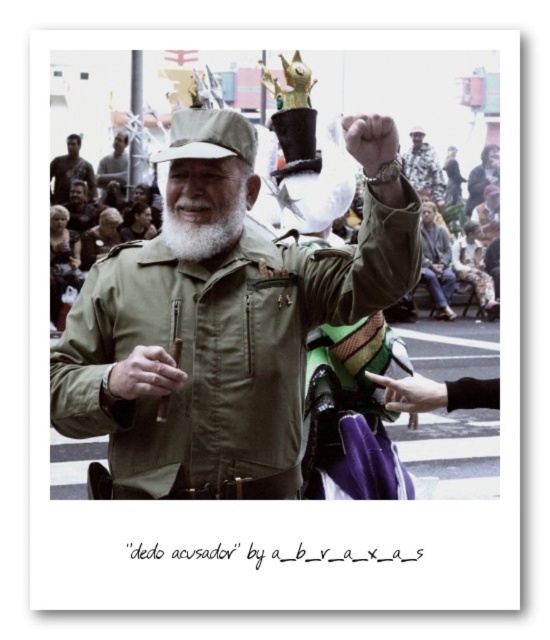
Question: Can you confirm if matte green jacket at center is positioned below matte brown shirt at upper left?

Choices:
 (A) yes
 (B) no

Answer: (A)

Question: Which of the following is the farthest from the observer?

Choices:
 (A) matte black cap at upper center
 (B) matte brown shirt at upper left
 (C) camouflage fabric watch at upper right
 (D) green matte jacket at center

Answer: (C)

Question: Is white matte beard at center closer to camera compared to matte brown hand at upper center?

Choices:
 (A) yes
 (B) no

Answer: (B)

Question: Which of the following is the farthest from the observer?

Choices:
 (A) camouflage fabric watch at upper right
 (B) matte khaki hat at center
 (C) matte brown hand at upper center

Answer: (A)

Question: Is matte khaki hat at center above matte brown shirt at upper left?

Choices:
 (A) no
 (B) yes

Answer: (A)

Question: Which of the following is the closest to the observer?

Choices:
 (A) (360, 140)
 (B) (168, 140)
 (C) (129, 376)
 (D) (229, 250)

Answer: (C)